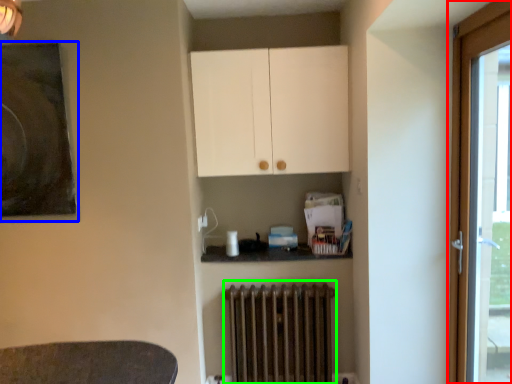
Question: Considering the real-world distances, which object is farthest from door (highlighted by a red box)? picture frame (highlighted by a blue box) or radiator (highlighted by a green box)?

Choices:
 (A) picture frame
 (B) radiator

Answer: (A)